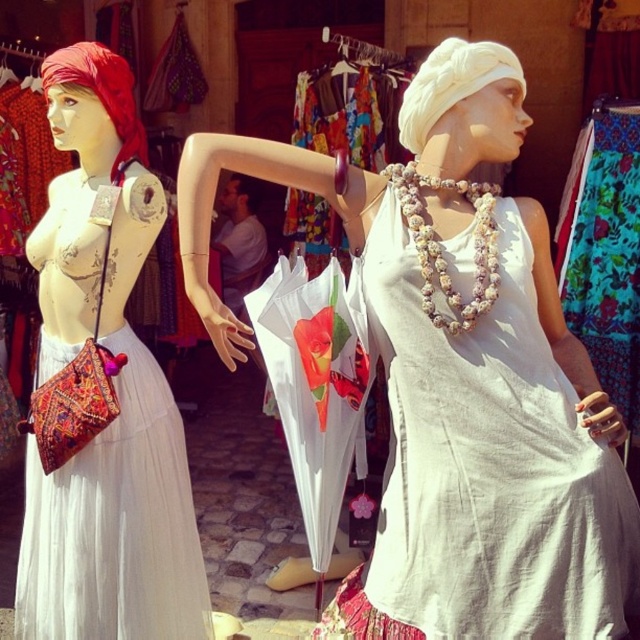
What is the color of the dress worn by the mannequin at the point specified as (102, 388)?

The point (102, 388) corresponds to the matte white dress at left, so the dress is white.

You are a customer at the market and want to buy a headscarf. You see the white fabric headscarf at upper center and the red satin headscarf at left. Which one is located to the right of the other?

The white fabric headscarf at upper center is positioned on the right side of red satin headscarf at left.